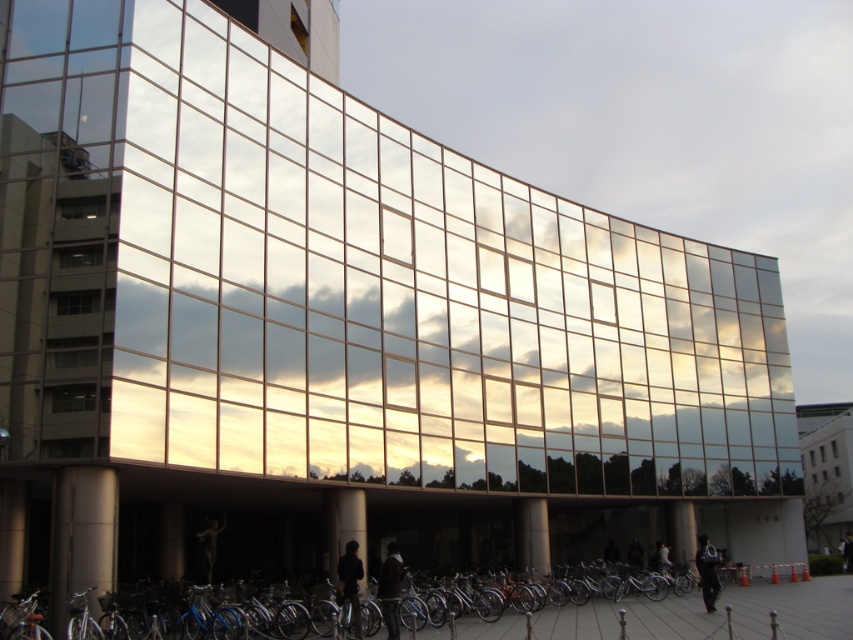
Question: Which of the following is the closest to the observer?

Choices:
 (A) silver metallic bicycle at lower center
 (B) dark brown leather jacket at lower center
 (C) dark matte jacket at center
 (D) dark brown leather jacket at lower right

Answer: (A)

Question: Does silver metallic bicycle at lower center appear over dark blue fabric jacket at lower right?

Choices:
 (A) no
 (B) yes

Answer: (B)

Question: Is dark brown leather jacket at lower center positioned at the back of dark brown leather jacket at lower right?

Choices:
 (A) no
 (B) yes

Answer: (A)

Question: Which object is farther from the camera taking this photo?

Choices:
 (A) dark brown leather jacket at lower right
 (B) dark brown leather jacket at lower center
 (C) dark blue fabric jacket at lower right
 (D) dark matte jacket at center

Answer: (A)

Question: Does dark matte jacket at center have a greater width compared to dark blue fabric jacket at lower right?

Choices:
 (A) yes
 (B) no

Answer: (B)

Question: Based on their relative distances, which object is nearer to the dark brown leather jacket at lower center?

Choices:
 (A) dark blue fabric jacket at lower right
 (B) dark matte jacket at center
 (C) dark brown leather jacket at lower right

Answer: (B)